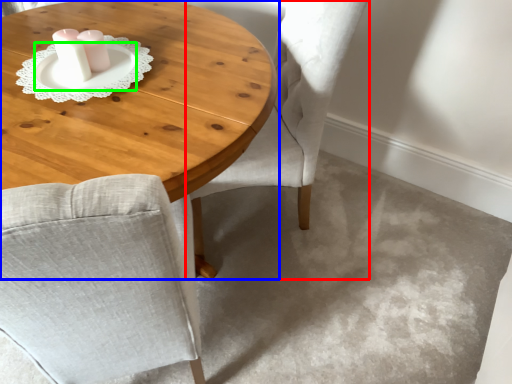
Question: Which is farther away from chair (highlighted by a red box)? coffee table (highlighted by a blue box) or saucer (highlighted by a green box)?

Choices:
 (A) coffee table
 (B) saucer

Answer: (B)